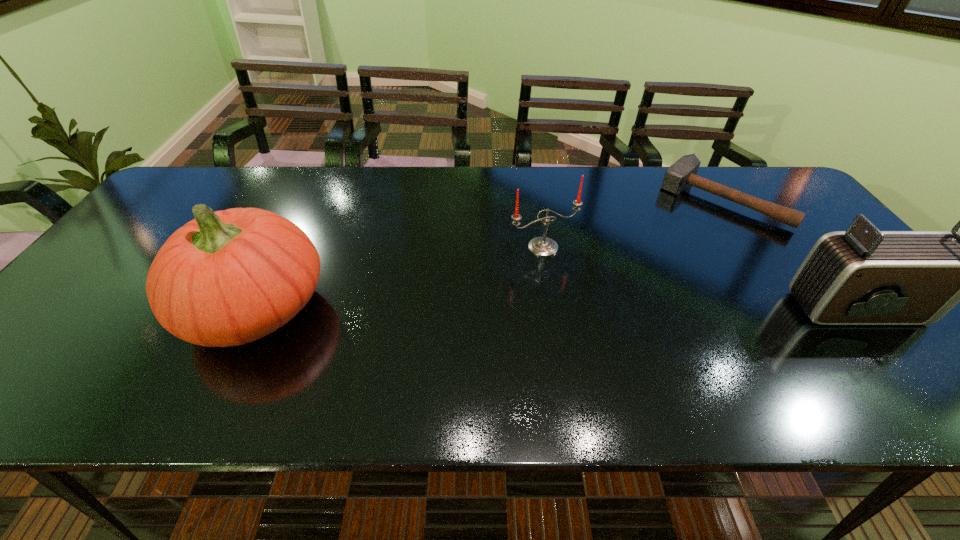
Locate an element on the screen. Image resolution: width=960 pixels, height=540 pixels. free location located 0.150m on the front-facing side of the second shortest object is located at coordinates (588, 295).

Find the location of a particular element. The image size is (960, 540). free region located 0.080m on the front-facing side of the second shortest object is located at coordinates (573, 276).

Locate an element on the screen. The image size is (960, 540). object located in the far edge section of the desktop is located at coordinates (682, 173).

I want to click on object that is at the near edge, so click(226, 278).

Find the location of a particular element. object that is positioned at the right edge is located at coordinates (682, 173).

Find the location of a particular element. object positioned at the far right corner is located at coordinates (682, 173).

In the image, there is a desktop. In order to click on vacant space at the far edge in this screenshot , I will do `click(535, 201)`.

I want to click on vacant space at the near edge of the desktop, so click(x=154, y=334).

This screenshot has width=960, height=540. Find the location of `free region at the left edge`. free region at the left edge is located at coordinates (169, 211).

I want to click on vacant space at the far left corner of the desktop, so click(x=181, y=183).